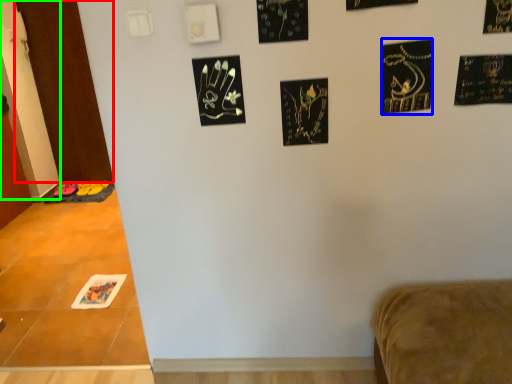
Question: Which object is positioned closest to door (highlighted by a red box)? Select from print (highlighted by a blue box) and door (highlighted by a green box).

Choices:
 (A) print
 (B) door

Answer: (B)